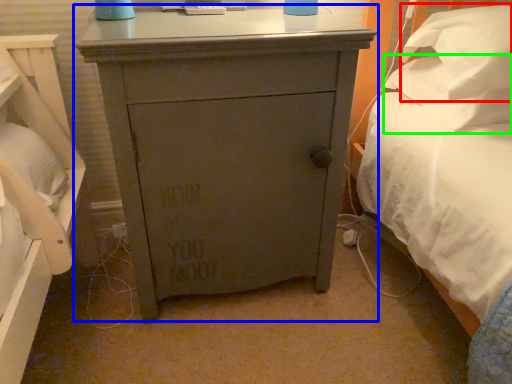
Question: Which is nearer to the pillow (highlighted by a red box)? chest of drawers (highlighted by a blue box) or pillow (highlighted by a green box).

Choices:
 (A) chest of drawers
 (B) pillow

Answer: (B)